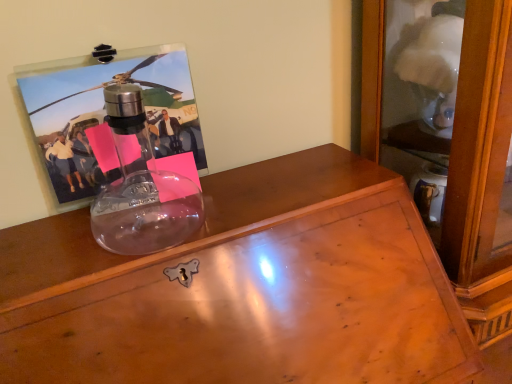
What is the approximate height of transparent glass desk at upper left?

30.02 inches.

Image resolution: width=512 pixels, height=384 pixels. What are the coordinates of `transparent glass desk at upper left` in the screenshot? It's located at (243, 289).

What do you see at coordinates (243, 289) in the screenshot? The width and height of the screenshot is (512, 384). I see `transparent glass desk at upper left` at bounding box center [243, 289].

This screenshot has width=512, height=384. Describe the element at coordinates (111, 115) in the screenshot. I see `clear plastic frame at upper left` at that location.

Measure the distance between clear plastic frame at upper left and camera.

clear plastic frame at upper left is 24.60 inches away from camera.

Locate an element on the screen. The height and width of the screenshot is (384, 512). clear plastic frame at upper left is located at coordinates (111, 115).

Find the location of a particular element. The height and width of the screenshot is (384, 512). transparent glass desk at upper left is located at coordinates (243, 289).

Would you say transparent glass desk at upper left is to the left or to the right of clear plastic frame at upper left in the picture?

transparent glass desk at upper left is to the right of clear plastic frame at upper left.

Does transparent glass desk at upper left come in front of clear plastic frame at upper left?

That is True.

Does point (294, 254) come behind point (56, 157)?

No, it is not.

From the image's perspective, is transparent glass desk at upper left located beneath clear plastic frame at upper left?

Correct, transparent glass desk at upper left appears lower than clear plastic frame at upper left in the image.

From a real-world perspective, does transparent glass desk at upper left sit lower than clear plastic frame at upper left?

Yes, from a real-world perspective, transparent glass desk at upper left is under clear plastic frame at upper left.

Can you confirm if transparent glass desk at upper left is thinner than clear plastic frame at upper left?

No, transparent glass desk at upper left is not thinner than clear plastic frame at upper left.

Between transparent glass desk at upper left and clear plastic frame at upper left, which one has less height?

Standing shorter between the two is clear plastic frame at upper left.

Based on the photo, considering the relative sizes of transparent glass desk at upper left and clear plastic frame at upper left in the image provided, is transparent glass desk at upper left smaller than clear plastic frame at upper left?

No.

Is transparent glass desk at upper left spatially inside clear plastic frame at upper left, or outside of it?

transparent glass desk at upper left lies outside clear plastic frame at upper left.

Is transparent glass desk at upper left far away from clear plastic frame at upper left?

That's not correct — transparent glass desk at upper left is a little close to clear plastic frame at upper left.

Is transparent glass desk at upper left aimed at clear plastic frame at upper left?

No.

In the scene shown: How distant is transparent glass desk at upper left from clear plastic frame at upper left?

A distance of 22.93 centimeters exists between transparent glass desk at upper left and clear plastic frame at upper left.

Locate an element on the screen. picture frame on the left of transparent glass desk at upper left is located at coordinates (111, 115).

Which is more to the left, clear plastic frame at upper left or transparent glass desk at upper left?

Positioned to the left is clear plastic frame at upper left.

Which object is closer to the camera taking this photo, clear plastic frame at upper left or transparent glass desk at upper left?

transparent glass desk at upper left.

Does point (114, 60) appear closer or farther from the camera than point (392, 340)?

Point (114, 60).

From the image's perspective, is clear plastic frame at upper left above or below transparent glass desk at upper left?

Clearly, from the image's perspective, clear plastic frame at upper left is above transparent glass desk at upper left.

From a real-world perspective, does clear plastic frame at upper left stand above transparent glass desk at upper left?

Yes.

Looking at this image, considering the relative sizes of clear plastic frame at upper left and transparent glass desk at upper left in the image provided, is clear plastic frame at upper left wider than transparent glass desk at upper left?

No, clear plastic frame at upper left is not wider than transparent glass desk at upper left.

Is clear plastic frame at upper left shorter than transparent glass desk at upper left?

Indeed, clear plastic frame at upper left has a lesser height compared to transparent glass desk at upper left.

Which of these two, clear plastic frame at upper left or transparent glass desk at upper left, is smaller?

Smaller between the two is clear plastic frame at upper left.

Can we say clear plastic frame at upper left lies outside transparent glass desk at upper left?

Yes, clear plastic frame at upper left is outside of transparent glass desk at upper left.

Is clear plastic frame at upper left not close to transparent glass desk at upper left?

No.

Is clear plastic frame at upper left facing away from transparent glass desk at upper left?

clear plastic frame at upper left is not turned away from transparent glass desk at upper left.

Looking at this image, how different are the orientations of clear plastic frame at upper left and transparent glass desk at upper left in degrees?

3.35 degrees separate the facing orientations of clear plastic frame at upper left and transparent glass desk at upper left.

Find the location of a particular element. picture frame on the left of transparent glass desk at upper left is located at coordinates (111, 115).

Where is `picture frame located above the transparent glass desk at upper left (from a real-world perspective)`? This screenshot has width=512, height=384. picture frame located above the transparent glass desk at upper left (from a real-world perspective) is located at coordinates click(x=111, y=115).

What are the coordinates of `desk in front of the clear plastic frame at upper left` in the screenshot? It's located at (243, 289).